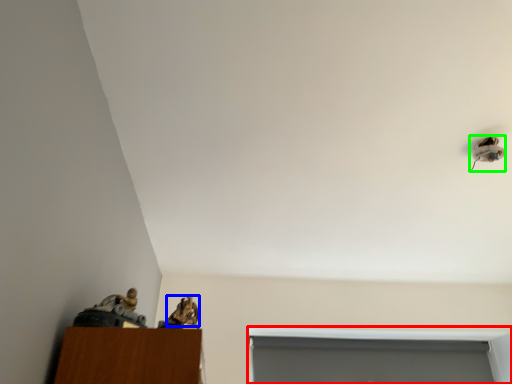
Question: Which object is the farthest from window (highlighted by a red box)? Choose among these: animal (highlighted by a blue box) or lamp (highlighted by a green box).

Choices:
 (A) animal
 (B) lamp

Answer: (A)